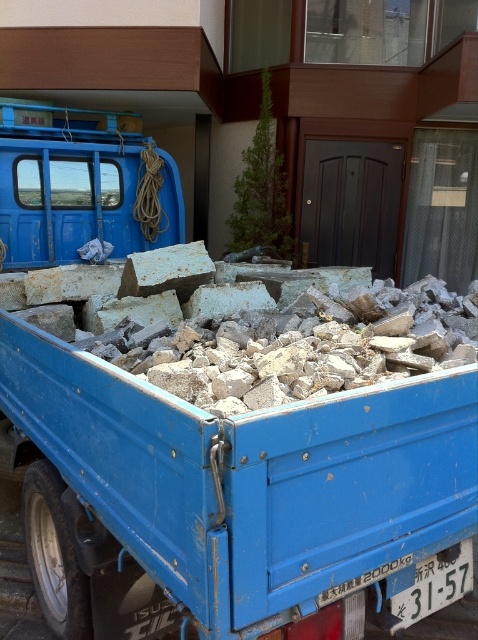
Can you confirm if blue matte truck at center is positioned below rusty concrete block at center?

Indeed, blue matte truck at center is positioned under rusty concrete block at center.

In the scene shown: How distant is blue matte truck at center from rusty concrete block at center?

The distance of blue matte truck at center from rusty concrete block at center is 4.17 feet.

Where is `blue matte truck at center`? The height and width of the screenshot is (640, 478). blue matte truck at center is located at coordinates (241, 470).

The height and width of the screenshot is (640, 478). Find the location of `blue matte truck at center`. blue matte truck at center is located at coordinates (241, 470).

Who is higher up, matte blue truck at upper left or rusty concrete block at center?

Positioned higher is matte blue truck at upper left.

Is matte blue truck at upper left below rusty concrete block at center?

Actually, matte blue truck at upper left is above rusty concrete block at center.

Is point (136, 212) in front of point (163, 289)?

That is False.

This screenshot has width=478, height=640. In order to click on matte blue truck at upper left in this screenshot , I will do `click(82, 186)`.

Does blue matte truck at center lie behind matte blue truck at upper left?

No, it is in front of matte blue truck at upper left.

Is blue matte truck at center below matte blue truck at upper left?

Indeed, blue matte truck at center is positioned under matte blue truck at upper left.

This screenshot has height=640, width=478. Describe the element at coordinates (241, 470) in the screenshot. I see `blue matte truck at center` at that location.

Find the location of a particular element. This screenshot has width=478, height=640. blue matte truck at center is located at coordinates (241, 470).